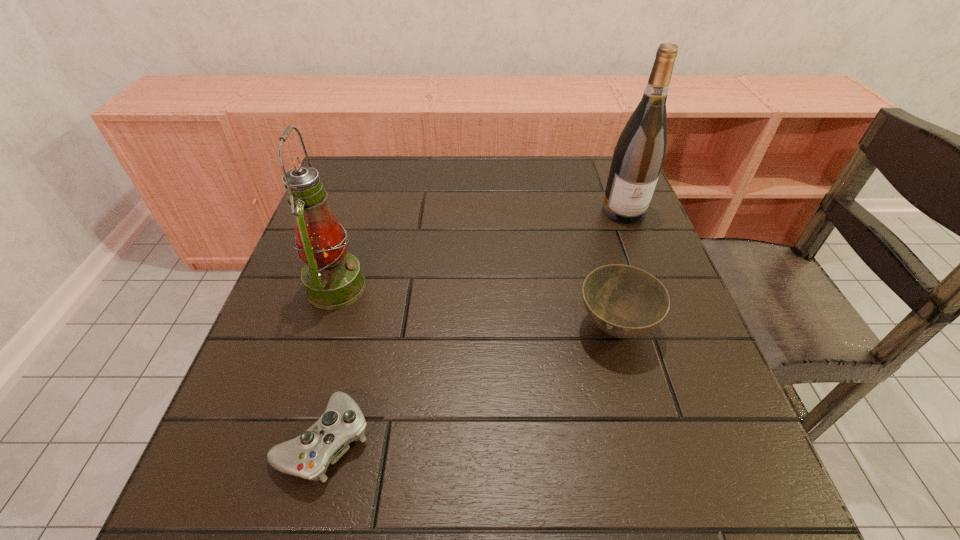
Identify the location of object located at the near edge. (308, 456).

Locate an element on the screen. This screenshot has height=540, width=960. oil lamp that is at the left edge is located at coordinates (332, 278).

Locate an element on the screen. Image resolution: width=960 pixels, height=540 pixels. control positioned at the left edge is located at coordinates (308, 456).

Where is `wine bottle present at the right edge`? wine bottle present at the right edge is located at coordinates (639, 154).

Locate an element on the screen. The image size is (960, 540). bowl at the right edge is located at coordinates (624, 301).

In order to click on object present at the near left corner in this screenshot , I will do `click(308, 456)`.

Identify the location of object present at the far right corner. (639, 154).

This screenshot has height=540, width=960. I want to click on free space at the far edge of the desktop, so click(x=533, y=156).

Where is `free location at the near edge`? free location at the near edge is located at coordinates (569, 519).

In the image, there is a desktop. Where is `vacant space at the left edge`? Image resolution: width=960 pixels, height=540 pixels. vacant space at the left edge is located at coordinates (278, 398).